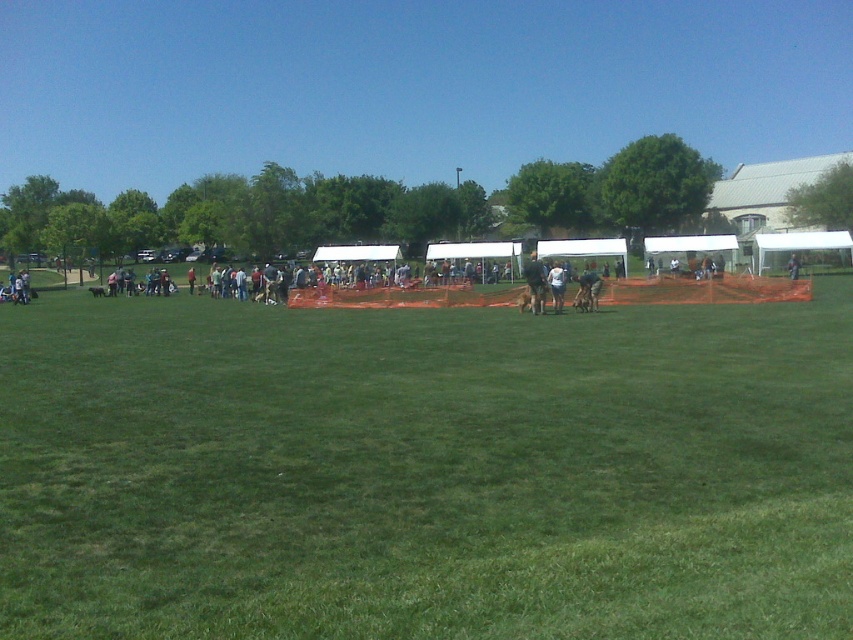
Between green grassy field at center and white cotton shirt at center, which one has more height?

green grassy field at center

Can you confirm if green grassy field at center is smaller than white cotton shirt at center?

No.

The image size is (853, 640). Identify the location of green grassy field at center. (425, 470).

Consider the image. Does white cotton shirt at center have a greater height compared to matte black dog at center?

In fact, white cotton shirt at center may be shorter than matte black dog at center.

Between point (560, 300) and point (793, 269), which one is positioned behind?

Positioned behind is point (793, 269).

Locate an element on the screen. The width and height of the screenshot is (853, 640). white cotton shirt at center is located at coordinates (556, 285).

Does green grassy field at center have a smaller size compared to matte black dog at center?

Incorrect, green grassy field at center is not smaller in size than matte black dog at center.

What do you see at coordinates (425, 470) in the screenshot? I see `green grassy field at center` at bounding box center [425, 470].

Is point (428, 448) in front of point (792, 253)?

Yes, point (428, 448) is in front of point (792, 253).

Locate an element on the screen. This screenshot has height=640, width=853. green grassy field at center is located at coordinates (425, 470).